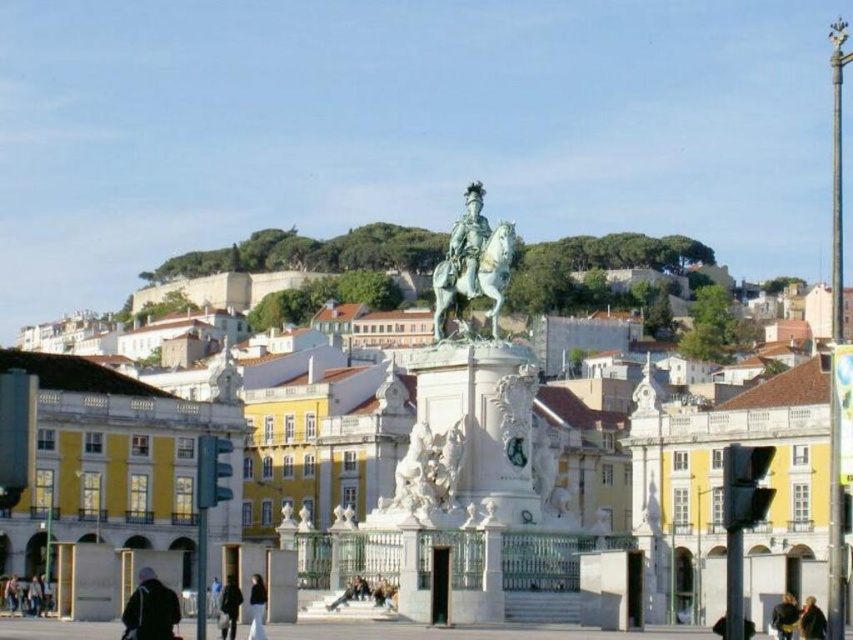
You are standing at the point with coordinates point (787, 611) and want to walk towards the equestrian statue. Is the point (431, 524) blocking your path?

Point (431, 524) is behind point (787, 611), so it is not in front of you. Therefore, the point (431, 524) will not block your path to the equestrian statue.

You are standing at the point closest to the equestrian statue in the plaza. You want to take a photo of the statue with both the point at point (485, 291) and the point at point (811, 612) in the background. Which point should you stand closer to ensure both points are visible in the photo?

You should stand closer to point (811, 612) because point (485, 291) is behind it, so positioning yourself near the front point allows both to be captured in the frame.